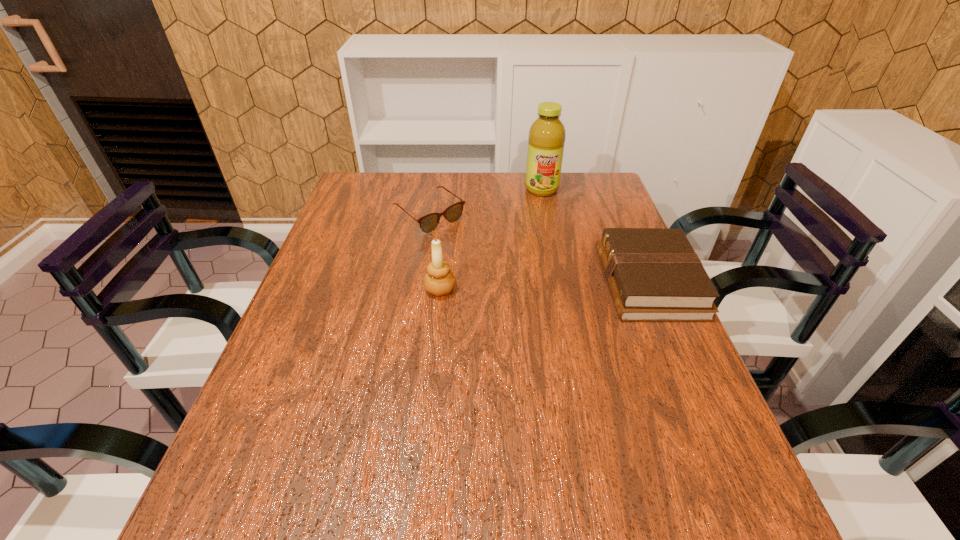
In the image, there is a desktop. Identify the location of vacant space at the near edge. (379, 472).

At what (x,y) coordinates should I click in order to perform the action: click on vacant space at the left edge of the desktop. Please return your answer as a coordinate pair (x, y). Looking at the image, I should click on (326, 323).

In order to click on vacant space at the right edge in this screenshot , I will do `click(613, 222)`.

In the image, there is a desktop. Find the location of `vacant space at the far left corner`. vacant space at the far left corner is located at coordinates (396, 183).

The width and height of the screenshot is (960, 540). Identify the location of vacant region at the far right corner of the desktop. (574, 179).

I want to click on free space at the near right corner, so click(695, 470).

Find the location of a particular element. The height and width of the screenshot is (540, 960). free space between the shortest object and the second shortest object is located at coordinates (540, 249).

In order to click on blank region between the spectacles and the fruit juice in this screenshot , I will do `click(486, 202)`.

I want to click on vacant point located between the candle_holder and the fruit juice, so click(x=491, y=239).

Locate an element on the screen. The height and width of the screenshot is (540, 960). unoccupied area between the Bible and the spectacles is located at coordinates (540, 249).